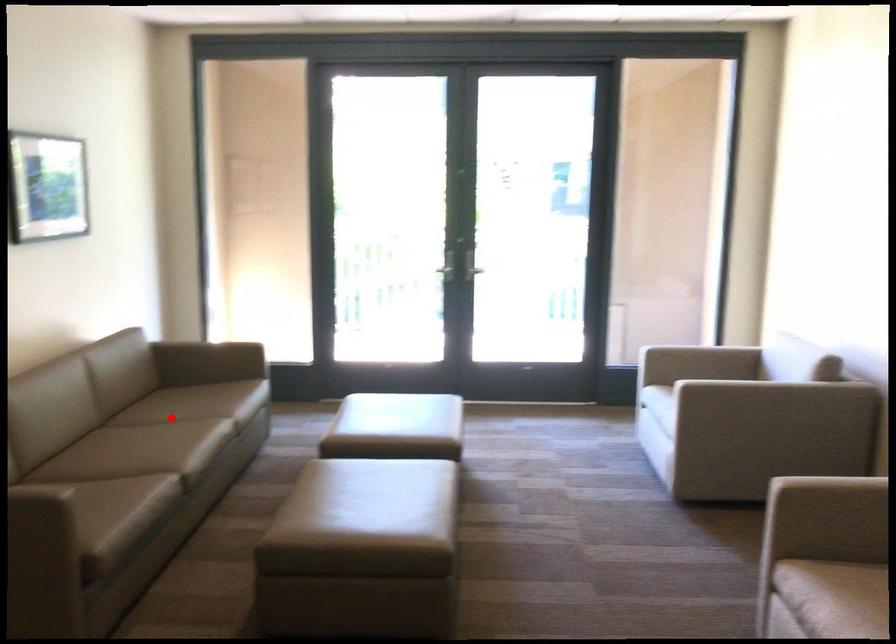
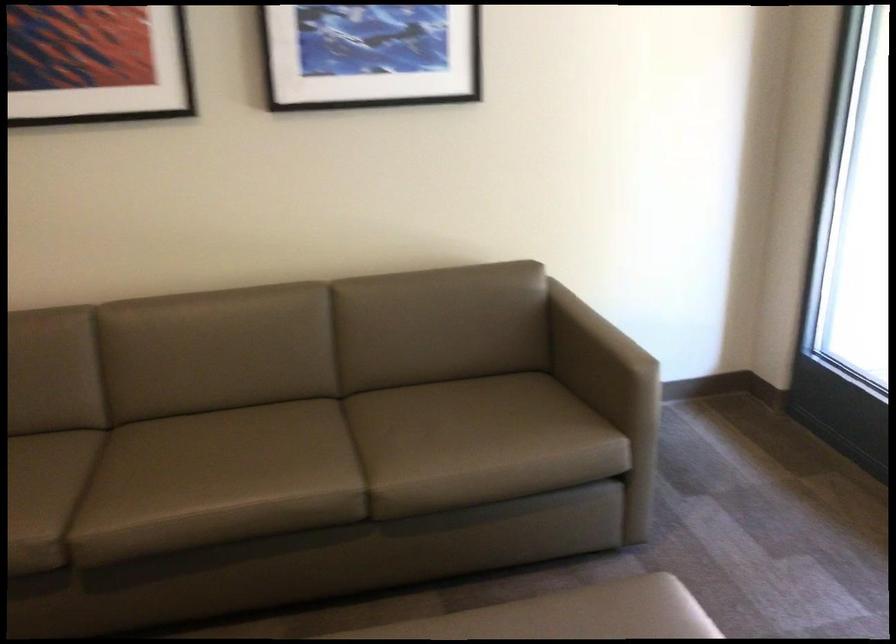
Question: I am providing you with two images of the same scene from different viewpoints. In image1, a red point is highlighted. Considering the same 3D point in image2, which of the following is correct?

Choices:
 (A) It is closer
 (B) It is farther

Answer: (A)